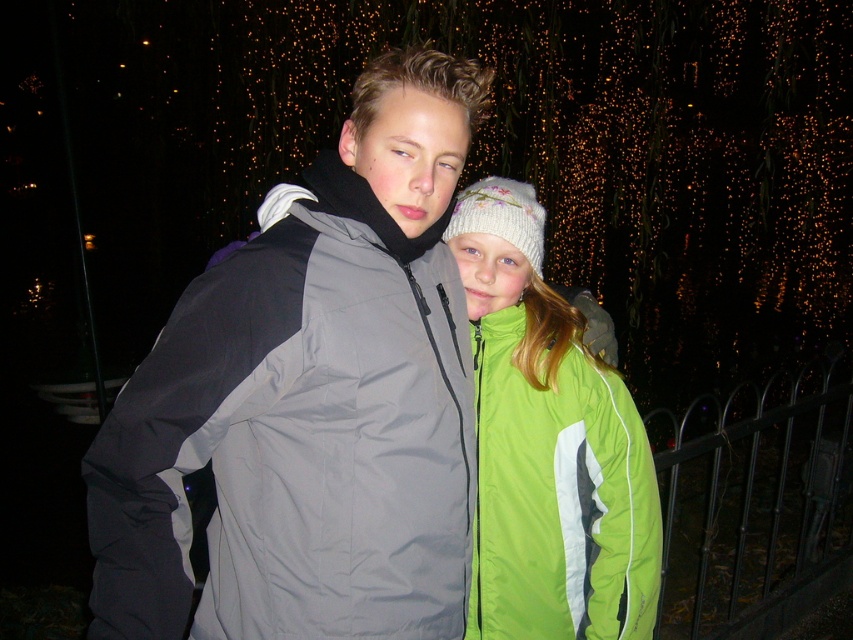
You are a photographer trying to capture a closeup shot of the gray synthetic jacket at center and the black wrought iron fence at lower right. Since you want to focus on the jacket, which object should you position closer to the camera?

You should position the gray synthetic jacket at center closer to the camera because it occupies less space than the black wrought iron fence at lower right, allowing it to be the main focus in the closeup shot.

You are a photographer trying to capture the green fabric jacket at center in the image. Based on its position coordinates, where exactly should you aim your camera?

The green fabric jacket at center is located at point (548, 445), so aim your camera at those coordinates to capture it accurately.

You are a delivery robot with a box that needs to be placed on a table located behind the gray synthetic jacket at center. The robot has a maximum reach of 1.2 meters. Can the robot reach the table without moving closer?

The gray synthetic jacket at center and the viewer are 1.13 meters apart. Since the robot can reach up to 1.2 meters, it can extend its arm to place the box on the table behind the gray synthetic jacket at center without needing to move closer.